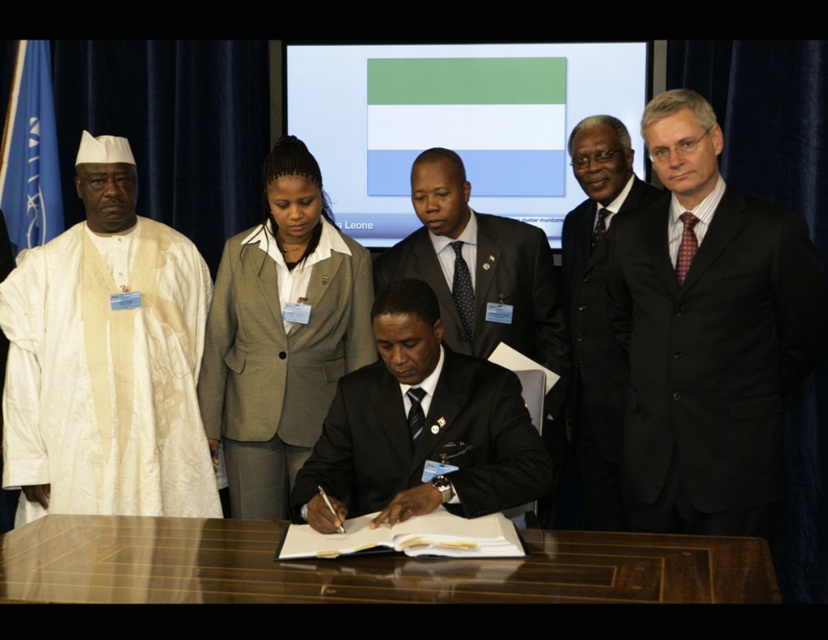
Question: Does black suit at right appear under white cloth at left?

Choices:
 (A) yes
 (B) no

Answer: (B)

Question: Estimate the real-world distances between objects in this image. Which object is farther from the white cloth at left?

Choices:
 (A) dark blue pinstripe suit at center
 (B) black satin business suit at right
 (C) gray woolen blazer at center

Answer: (B)

Question: Which point appears closest to the camera in this image?

Choices:
 (A) (735, 308)
 (B) (355, 364)
 (C) (422, 321)
 (D) (590, 339)

Answer: (C)

Question: Considering the real-world distances, which object is farthest from the white cloth at left?

Choices:
 (A) wooden at center
 (B) dark gray wool business suit at left

Answer: (A)

Question: Is white cloth at left closer to the viewer compared to wooden at center?

Choices:
 (A) yes
 (B) no

Answer: (B)

Question: Can you confirm if dark blue pinstripe suit at center is bigger than black satin business suit at right?

Choices:
 (A) no
 (B) yes

Answer: (A)